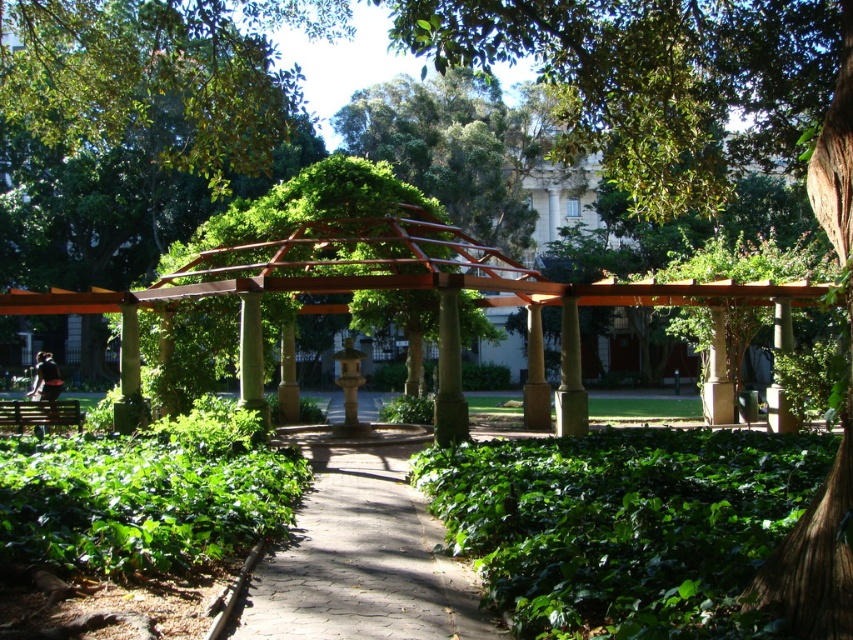
You are planning to install a new lighting system in the garden. The lights need to be placed above the green leafy tree at center and the brown cobblestone path at center. Which object requires taller light poles?

The green leafy tree at center requires taller light poles because it is much taller than the brown cobblestone path at center.

You are planning to place a new bench in the garden scene. The bench requires a space that can accommodate its size. Given the presence of the green leafy tree at center and the green leafy bush at center, which object would allow more space around it for placing the bench?

The green leafy tree at center is larger in size than the green leafy bush at center, so there would be more space around the green leafy bush at center to place the bench.

You are standing at the entrance of the garden and see the traditional red metal arbor supported by multiple columns and the point labeled as point (624,525). Which object is closer to you?

The point labeled as point (624,525) corresponds to the green leafy bush at center, which is closer to you than the traditional red metal arbor supported by multiple columns.